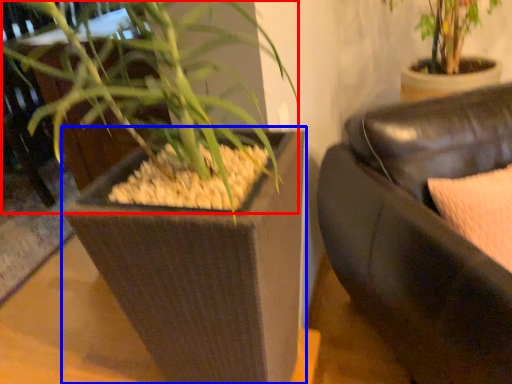
Question: Which point is closer to the camera, orchid (highlighted by a red box) or flowerpot (highlighted by a blue box)?

Choices:
 (A) orchid
 (B) flowerpot

Answer: (A)